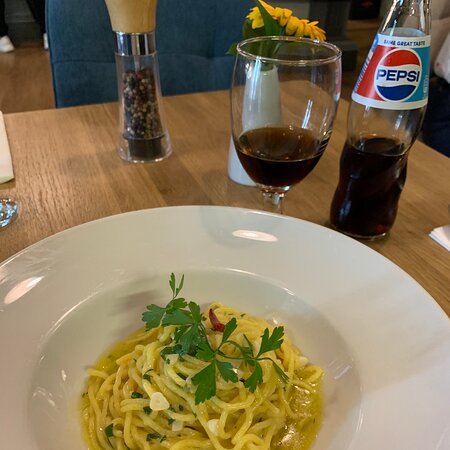
Where is `1 drink in glass`? 1 drink in glass is located at coordinates (290, 173).